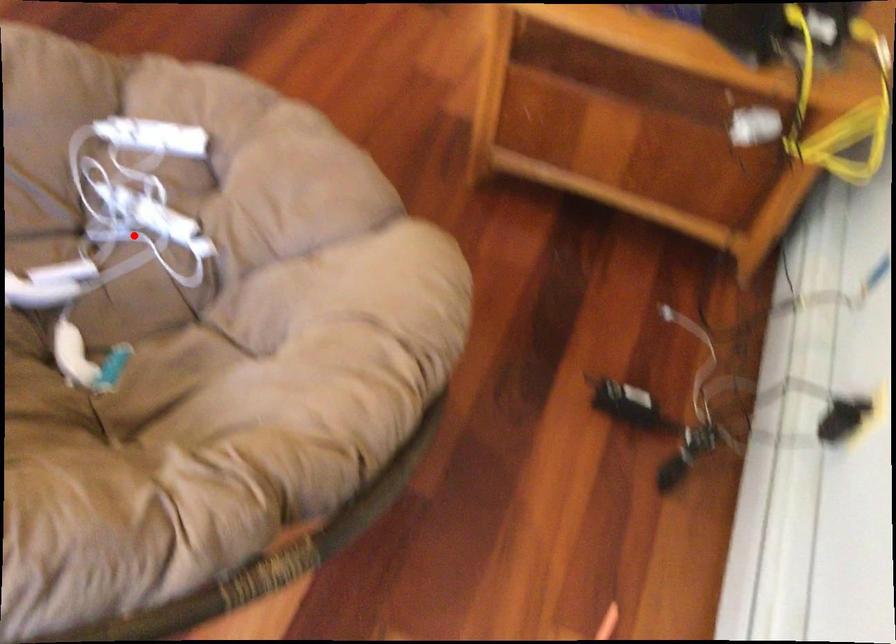
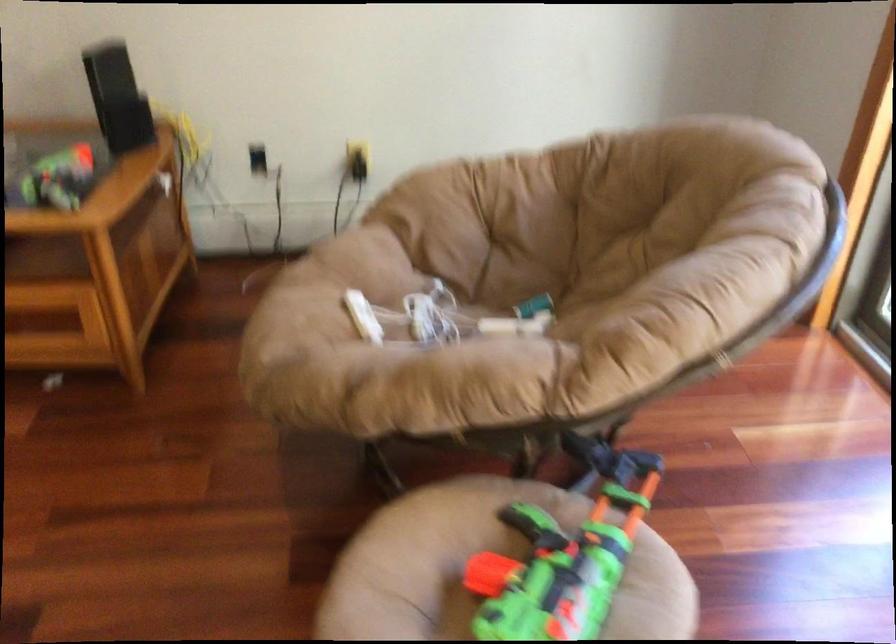
The point at the highlighted location is marked in the first image. Where is the corresponding point in the second image?

(442, 317)